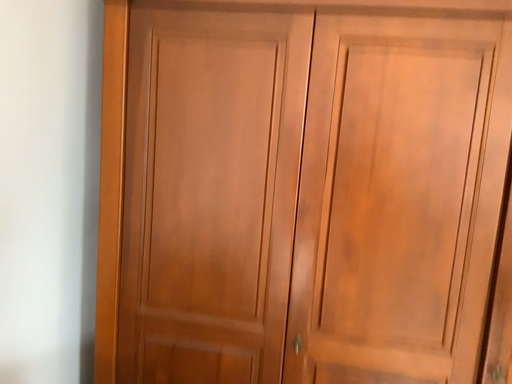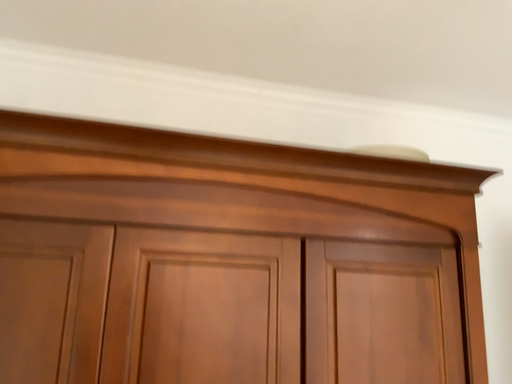
Question: How did the camera likely rotate when shooting the video?

Choices:
 (A) rotated right
 (B) rotated left

Answer: (A)